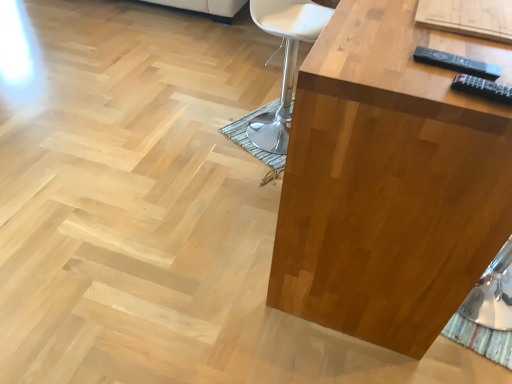
Describe the element at coordinates (284, 61) in the screenshot. I see `white leather chair at center` at that location.

The height and width of the screenshot is (384, 512). What are the coordinates of `satin wood table at right` in the screenshot? It's located at (389, 181).

At what (x,y) coordinates should I click in order to perform the action: click on black plastic remote at upper right, the first remote in the top-to-bottom sequence. Please return your answer as a coordinate pair (x, y). Looking at the image, I should click on (457, 63).

You are a GUI agent. You are given a task and a screenshot of the screen. Output one action in this format:
    pyautogui.click(x=<x>, y=<y>)
    Task: Click on the white leather chair at center
    The width and height of the screenshot is (512, 384).
    Given the screenshot: What is the action you would take?
    pyautogui.click(x=284, y=61)

Based on their sizes in the image, would you say black plastic remote at upper right, which appears as the second remote when viewed from the front, is bigger or smaller than white leather chair at center?

In the image, black plastic remote at upper right, which appears as the second remote when viewed from the front, appears to be smaller than white leather chair at center.

Considering the sizes of objects black plastic remote at upper right, positioned as the second remote in bottom-to-top order, and white leather chair at center in the image provided, who is shorter, black plastic remote at upper right, positioned as the second remote in bottom-to-top order, or white leather chair at center?

black plastic remote at upper right, positioned as the second remote in bottom-to-top order, is shorter.

Which is closer, (x=447, y=68) or (x=250, y=4)?

Point (x=447, y=68) appears to be closer to the viewer than point (x=250, y=4).

Is black plastic remote at upper right, which appears as the second remote when viewed from the front, oriented towards white leather chair at center?

No, black plastic remote at upper right, which appears as the second remote when viewed from the front, is not facing towards white leather chair at center.

Is black plastic remote at upper right, the second remote from the top, located outside satin wood table at right?

No, black plastic remote at upper right, the second remote from the top, is not outside of satin wood table at right.

Is black plastic remote at upper right, placed as the 1th remote when sorted from front to back, next to satin wood table at right and touching it?

They are not placed beside each other.

Is black plastic remote at upper right, the 2th remote viewed from the back, shorter than satin wood table at right?

Yes, black plastic remote at upper right, the 2th remote viewed from the back, is shorter than satin wood table at right.

Can you confirm if black plastic remote at upper right, the 2th remote viewed from the back, is thinner than satin wood table at right?

Correct, the width of black plastic remote at upper right, the 2th remote viewed from the back, is less than that of satin wood table at right.

The width and height of the screenshot is (512, 384). I want to click on chair below the satin wood table at right (from a real-world perspective), so tap(284, 61).

Is satin wood table at right further to the viewer compared to white leather chair at center?

No, it is not.

Can you confirm if satin wood table at right is bigger than white leather chair at center?

Indeed, satin wood table at right has a larger size compared to white leather chair at center.

From the picture: Is satin wood table at right aimed at white leather chair at center?

Yes.

Is white leather chair at center looking in the opposite direction of black plastic remote at upper right, the 1th remote positioned from the back?

No, white leather chair at center is not facing the opposite direction of black plastic remote at upper right, the 1th remote positioned from the back.

From a real-world perspective, is white leather chair at center over black plastic remote at upper right, which appears as the second remote when viewed from the front?

No, from a real-world perspective, white leather chair at center is not over black plastic remote at upper right, which appears as the second remote when viewed from the front

Is the surface of white leather chair at center in direct contact with black plastic remote at upper right, which appears as the second remote when viewed from the front?

No, white leather chair at center is not beside black plastic remote at upper right, which appears as the second remote when viewed from the front.

Can you tell me how much white leather chair at center and black plastic remote at upper right, the first remote in the top-to-bottom sequence, differ in facing direction?

They differ by 65.9 degrees in their facing directions.

From the image's perspective, would you say satin wood table at right is positioned over black plastic remote at upper right, the second remote from the top?

Indeed, from the image's perspective, satin wood table at right is shown above black plastic remote at upper right, the second remote from the top.

Is satin wood table at right turned away from black plastic remote at upper right, arranged as the first remote when ordered from the bottom?

No, black plastic remote at upper right, arranged as the first remote when ordered from the bottom, is not at the back of satin wood table at right.

Does satin wood table at right have a greater width compared to black plastic remote at upper right, the 2th remote viewed from the back?

Indeed, satin wood table at right has a greater width compared to black plastic remote at upper right, the 2th remote viewed from the back.

From the image's perspective, relative to black plastic remote at upper right, the second remote from the top, is black plastic remote at upper right, the 1th remote positioned from the back, above or below?

black plastic remote at upper right, the 1th remote positioned from the back, is situated higher than black plastic remote at upper right, the second remote from the top, in the image.

From a real-world perspective, between black plastic remote at upper right, the first remote in the top-to-bottom sequence, and black plastic remote at upper right, the 2th remote viewed from the back, who is vertically lower?

black plastic remote at upper right, the first remote in the top-to-bottom sequence, is physically lower.

How many degrees apart are the facing directions of black plastic remote at upper right, which appears as the second remote when viewed from the front, and black plastic remote at upper right, the 2th remote viewed from the back?

The angle between the facing direction of black plastic remote at upper right, which appears as the second remote when viewed from the front, and the facing direction of black plastic remote at upper right, the 2th remote viewed from the back, is 8.87 degrees.

You are a GUI agent. You are given a task and a screenshot of the screen. Output one action in this format:
    pyautogui.click(x=<x>, y=<y>)
    Task: Click on the table in front of the black plastic remote at upper right, which appears as the second remote when viewed from the front
    The width and height of the screenshot is (512, 384).
    Given the screenshot: What is the action you would take?
    tap(389, 181)

Does satin wood table at right have a larger size compared to black plastic remote at upper right, positioned as the second remote in bottom-to-top order?

Correct, satin wood table at right is larger in size than black plastic remote at upper right, positioned as the second remote in bottom-to-top order.

How different are the orientations of satin wood table at right and black plastic remote at upper right, the 1th remote positioned from the back, in degrees?

There is a 89.8-degree angle between the facing directions of satin wood table at right and black plastic remote at upper right, the 1th remote positioned from the back.

Which object is further away from the camera, satin wood table at right or black plastic remote at upper right, positioned as the second remote in bottom-to-top order?

black plastic remote at upper right, positioned as the second remote in bottom-to-top order, is behind.

This screenshot has width=512, height=384. There is a white leather chair at center. Find the location of `the 1st remote below it (from the image's perspective)`. the 1st remote below it (from the image's perspective) is located at coordinates (457, 63).

You are a GUI agent. You are given a task and a screenshot of the screen. Output one action in this format:
    pyautogui.click(x=<x>, y=<y>)
    Task: Click on the remote that is the 2nd one above the satin wood table at right (from a real-world perspective)
    The height and width of the screenshot is (384, 512).
    Given the screenshot: What is the action you would take?
    pyautogui.click(x=482, y=88)

From the image, which object appears to be farther from black plastic remote at upper right, the 2th remote viewed from the back, satin wood table at right or black plastic remote at upper right, the 1th remote positioned from the back?

Among the two, satin wood table at right is located further to black plastic remote at upper right, the 2th remote viewed from the back.

Which object lies further to the anchor point satin wood table at right, white leather chair at center or black plastic remote at upper right, the first remote in the top-to-bottom sequence?

white leather chair at center is positioned further to the anchor satin wood table at right.

From the image, which object appears to be farther from black plastic remote at upper right, the 2th remote viewed from the back, white leather chair at center or satin wood table at right?

white leather chair at center lies further to black plastic remote at upper right, the 2th remote viewed from the back, than the other object.

Considering their positions, is black plastic remote at upper right, positioned as the second remote in bottom-to-top order, positioned further to black plastic remote at upper right, the second remote from the top, than satin wood table at right?

satin wood table at right is positioned further to the anchor black plastic remote at upper right, the second remote from the top.

Which object lies nearer to the anchor point satin wood table at right, black plastic remote at upper right, positioned as the second remote in bottom-to-top order, or black plastic remote at upper right, arranged as the first remote when ordered from the bottom?

black plastic remote at upper right, positioned as the second remote in bottom-to-top order, is positioned closer to the anchor satin wood table at right.

Which object lies further to the anchor point satin wood table at right, black plastic remote at upper right, arranged as the first remote when ordered from the bottom, or white leather chair at center?

Based on the image, white leather chair at center appears to be further to satin wood table at right.

Estimate the real-world distances between objects in this image. Which object is further from black plastic remote at upper right, positioned as the second remote in bottom-to-top order, white leather chair at center or satin wood table at right?

white leather chair at center.

Estimate the real-world distances between objects in this image. Which object is further from satin wood table at right, black plastic remote at upper right, the 1th remote positioned from the back, or white leather chair at center?

white leather chair at center.

Identify the location of remote positioned between black plastic remote at upper right, placed as the 1th remote when sorted from front to back, and white leather chair at center from near to far. The height and width of the screenshot is (384, 512). (457, 63).

Where is `remote between black plastic remote at upper right, positioned as the second remote in bottom-to-top order, and satin wood table at right`? The image size is (512, 384). remote between black plastic remote at upper right, positioned as the second remote in bottom-to-top order, and satin wood table at right is located at coordinates (482, 88).